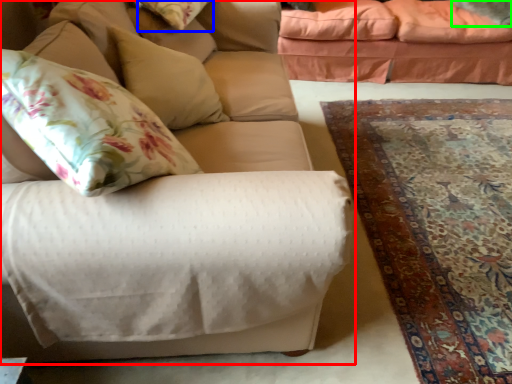
Question: Based on their relative distances, which object is farther from studio couch (highlighted by a red box)? Choose from pillow (highlighted by a blue box) and pillow (highlighted by a green box).

Choices:
 (A) pillow
 (B) pillow

Answer: (B)